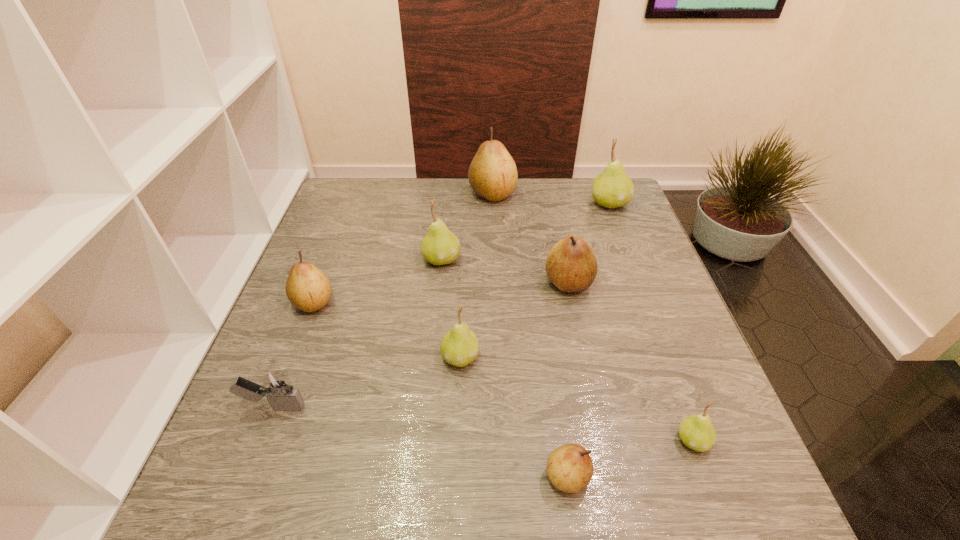
The image size is (960, 540). I want to click on object that is the third closest to the leftmost brown pear, so click(x=459, y=347).

At what (x,y) coordinates should I click in order to perform the action: click on the second closest pear relative to the seventh farthest object. Please return your answer as a coordinate pair (x, y). The width and height of the screenshot is (960, 540). Looking at the image, I should click on (459, 347).

Where is `the fifth closest pear relative to the second farthest green pear`? the fifth closest pear relative to the second farthest green pear is located at coordinates (613, 188).

This screenshot has height=540, width=960. Identify the location of the third closest brown pear to the third smallest brown pear. (308, 288).

Locate which brown pear is the second closest to the smallest green pear. Please provide its 2D coordinates. Your answer should be formatted as a tuple, i.e. [(x, y)], where the tuple contains the x and y coordinates of a point satisfying the conditions above.

[(571, 265)]

Locate which green pear ranks third in proximity to the third nearest pear. Please provide its 2D coordinates. Your answer should be formatted as a tuple, i.e. [(x, y)], where the tuple contains the x and y coordinates of a point satisfying the conditions above.

[(613, 188)]

Identify the location of green pear that is the second closest to the smallest green pear. (440, 246).

In order to click on vacant area that satisfies the following two spatial constraints: 1. on the front side of the nearest green pear; 2. on the right side of the second smallest brown pear in this screenshot , I will do `click(261, 440)`.

The width and height of the screenshot is (960, 540). What are the coordinates of `vacant space that satisfies the following two spatial constraints: 1. on the back side of the farthest green pear; 2. on the right side of the leftmost pear` in the screenshot? It's located at coord(351,204).

Locate an element on the screen. This screenshot has height=540, width=960. free space that satisfies the following two spatial constraints: 1. on the back side of the biggest brown pear; 2. on the left side of the sixth farthest object is located at coordinates (467, 194).